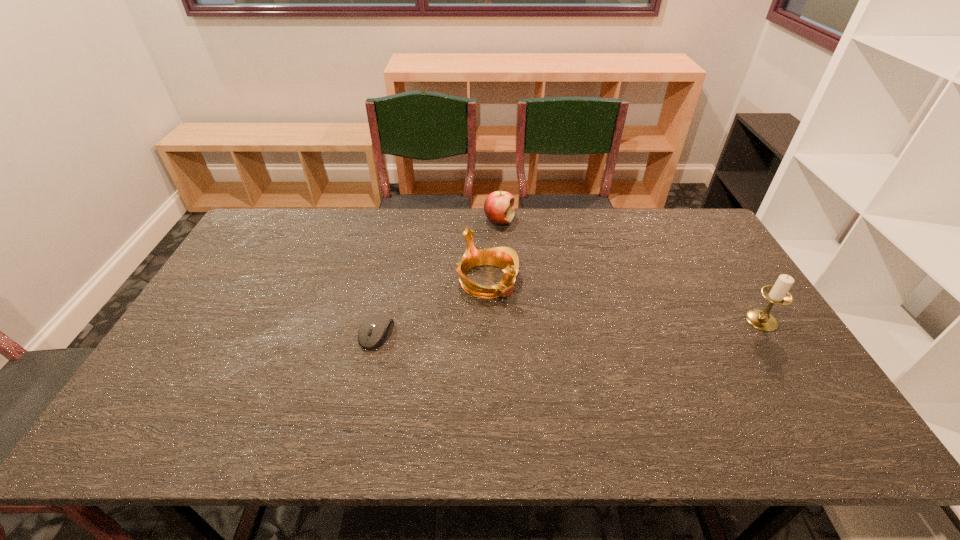
Locate which object is the third closest to the second farthest object. Please provide its 2D coordinates. Your answer should be formatted as a tuple, i.e. [(x, y)], where the tuple contains the x and y coordinates of a point satisfying the conditions above.

[(779, 294)]

Select which object is the third closest to the candle holder. Please provide its 2D coordinates. Your answer should be formatted as a tuple, i.e. [(x, y)], where the tuple contains the x and y coordinates of a point satisfying the conditions above.

[(381, 326)]

At what (x,y) coordinates should I click in order to perform the action: click on vacant area that satisfies the following two spatial constraints: 1. on the back side of the tiara; 2. on the right side of the computer equipment. Please return your answer as a coordinate pair (x, y). Looking at the image, I should click on (389, 281).

This screenshot has width=960, height=540. I want to click on vacant space that satisfies the following two spatial constraints: 1. on the front side of the rightmost object; 2. on the left side of the apple, so coord(505,320).

This screenshot has width=960, height=540. In order to click on blank area in the image that satisfies the following two spatial constraints: 1. on the front side of the apple; 2. on the right side of the tallest object in this screenshot , I will do click(x=505, y=320).